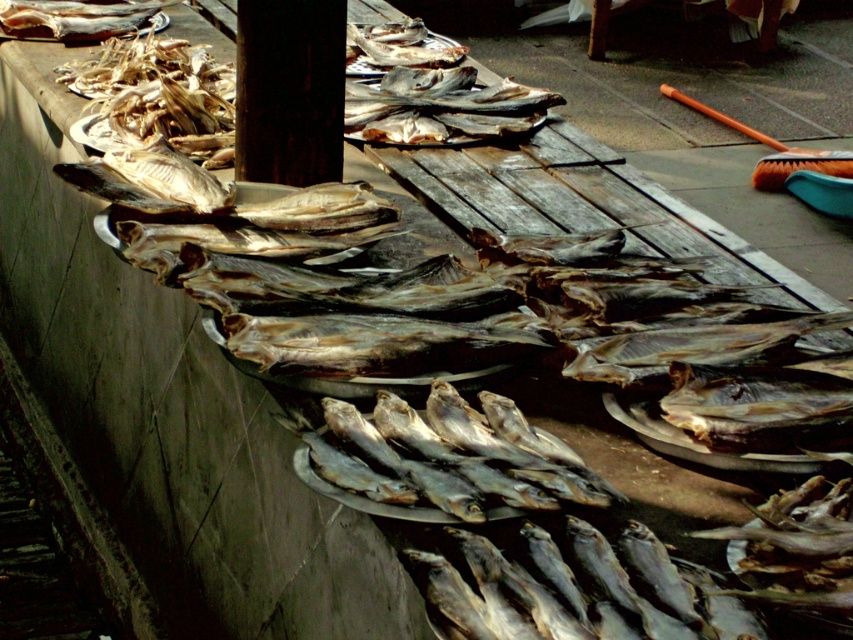
You are a customer at the fish market. You want to buy a dried silver fish at center and a shiny silver fish at upper left. However, your bag can only hold items that take up the same amount of space. Which fish should you choose to ensure they both fit?

You should choose the dried silver fish at center and the shiny silver fish at upper left because the dried silver fish at center occupies less space than the shiny silver fish at upper left, so together they might exceed the bag capacity. Wait, but the question says the bag can only hold items that take up the same amount of space. Since they don

You are a customer at the fish market and want to buy a dried silver fish. The market has a rule that you can only purchase items located at the center of the market. Is the dried silver fish at point (x=373, y=342) available for purchase?

The dried silver fish at point (x=373, y=342) is located at the center of the market, so it is available for purchase.

You are a customer at the fish market and want to pick up the dried silver fish at center and the shiny silver fish at upper left. How far apart are these two fish from each other?

The dried silver fish at center is 2.54 meters away from the shiny silver fish at upper left.